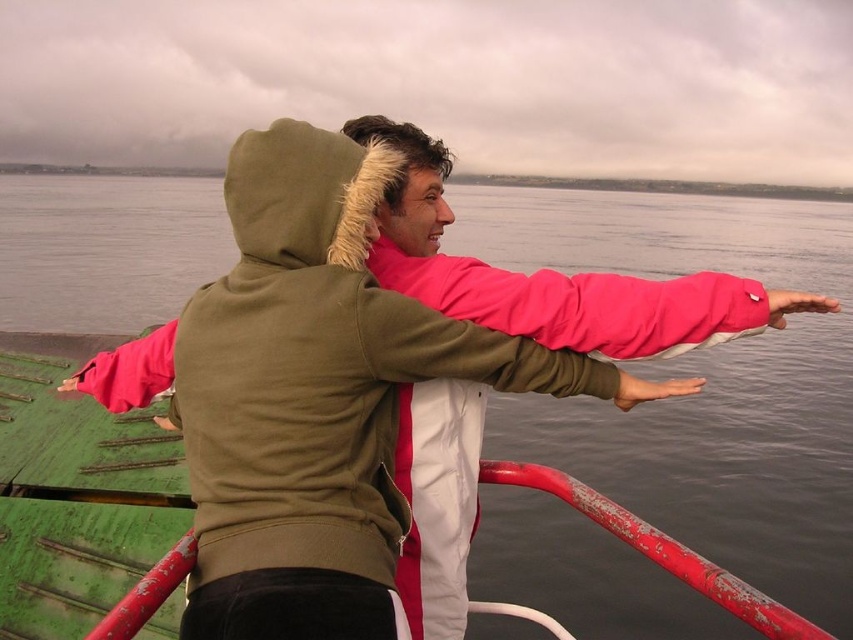
Question: Is pink matte jacket at center thinner than rusty metal rail at lower right?

Choices:
 (A) no
 (B) yes

Answer: (A)

Question: Which point appears farthest from the camera in this image?

Choices:
 (A) (804, 636)
 (B) (666, 502)

Answer: (B)

Question: Which of these objects is positioned farthest from the rusty metal rail at lower right?

Choices:
 (A) green matte water at center
 (B) pink matte jacket at center

Answer: (A)

Question: Does pink matte jacket at center lie behind rusty metal rail at lower right?

Choices:
 (A) no
 (B) yes

Answer: (B)

Question: Does green matte water at center come in front of pink matte jacket at center?

Choices:
 (A) no
 (B) yes

Answer: (A)

Question: Based on their relative distances, which object is nearer to the green matte water at center?

Choices:
 (A) pink matte jacket at center
 (B) rusty metal rail at lower right

Answer: (A)